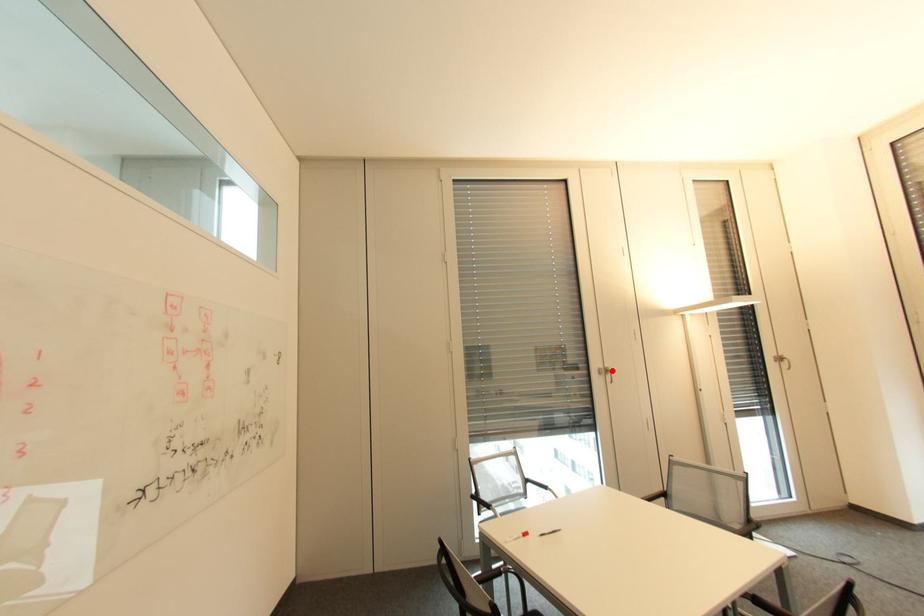
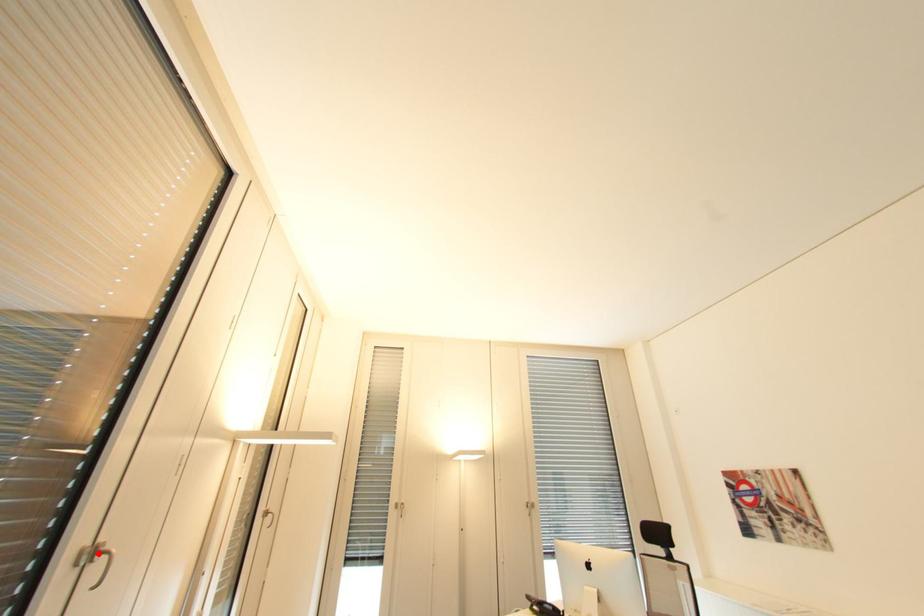
I am providing you with two images of the same scene from different viewpoints. A red point is marked on the first image and another point is marked on the second image. Is the marked point in image1 the same physical position as the marked point in image2?

Yes